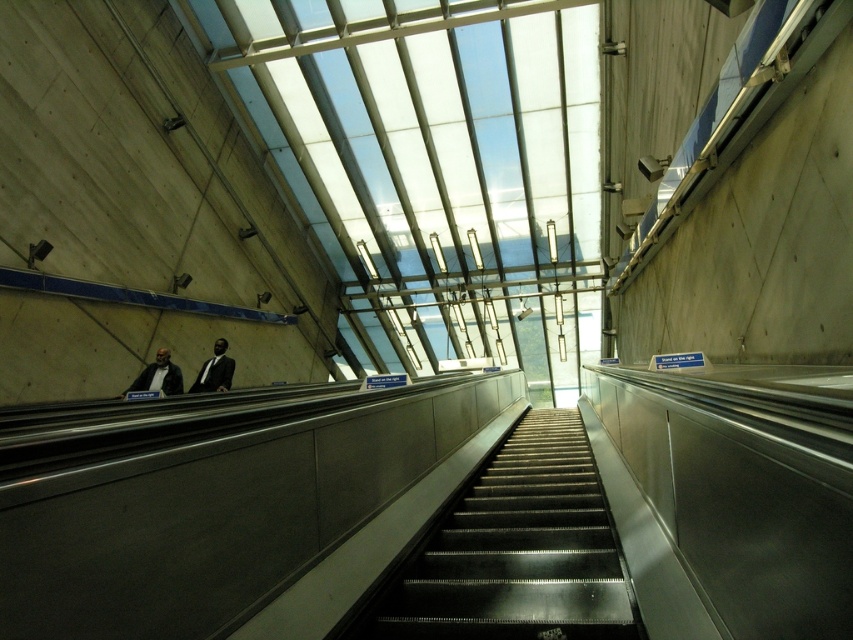
Is matte black suit at center bigger than matte black suit at left?

Yes, matte black suit at center is bigger than matte black suit at left.

Which is more to the right, matte black suit at center or matte black suit at left?

From the viewer's perspective, matte black suit at left appears more on the right side.

Locate an element on the screen. The height and width of the screenshot is (640, 853). matte black suit at center is located at coordinates (158, 376).

Image resolution: width=853 pixels, height=640 pixels. Identify the location of metallic gray stairs at center. (515, 552).

Is metallic gray stairs at center to the right of matte black suit at left from the viewer's perspective?

Correct, you'll find metallic gray stairs at center to the right of matte black suit at left.

You are a GUI agent. You are given a task and a screenshot of the screen. Output one action in this format:
    pyautogui.click(x=<x>, y=<y>)
    Task: Click on the metallic gray stairs at center
    The width and height of the screenshot is (853, 640).
    Given the screenshot: What is the action you would take?
    pyautogui.click(x=515, y=552)

Locate an element on the screen. The image size is (853, 640). metallic gray stairs at center is located at coordinates (515, 552).

Does metallic gray stairs at center have a greater height compared to matte black suit at center?

In fact, metallic gray stairs at center may be shorter than matte black suit at center.

Where is `metallic gray stairs at center`? The height and width of the screenshot is (640, 853). metallic gray stairs at center is located at coordinates (515, 552).

Locate an element on the screen. The height and width of the screenshot is (640, 853). metallic gray stairs at center is located at coordinates (515, 552).